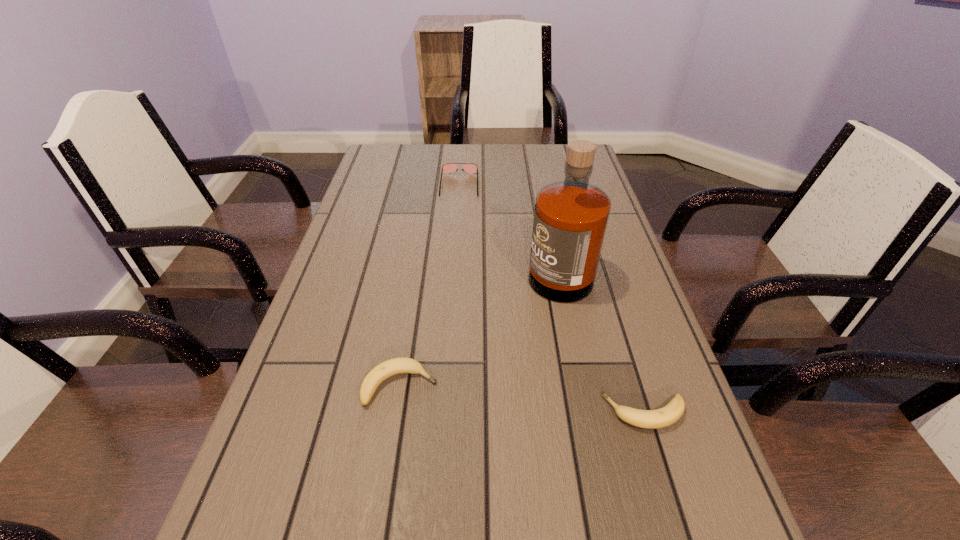
Locate which object is the closest to the right banana. Please provide its 2D coordinates. Your answer should be formatted as a tuple, i.e. [(x, y)], where the tuple contains the x and y coordinates of a point satisfying the conditions above.

[(570, 221)]